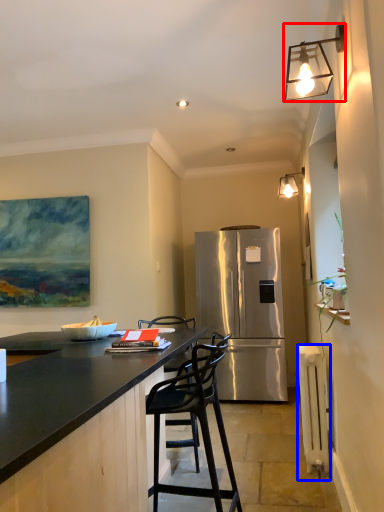
Question: Which point is further to the camera, lamp (highlighted by a red box) or radiator (highlighted by a blue box)?

Choices:
 (A) lamp
 (B) radiator

Answer: (B)